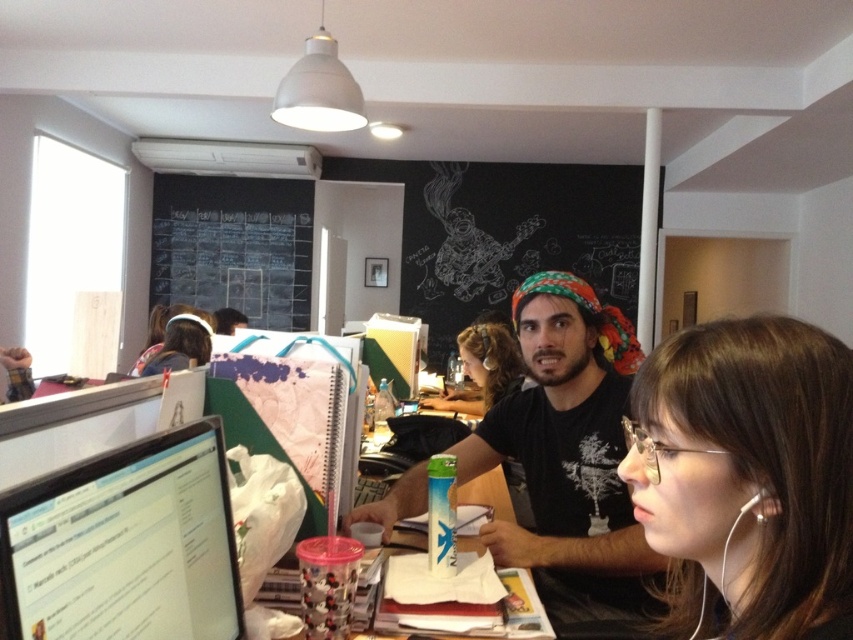
Question: Is matte black headphones at center positioned at the back of matte black hair at upper left?

Choices:
 (A) no
 (B) yes

Answer: (A)

Question: Which of these objects is positioned closest to the black t-shirt at center?

Choices:
 (A) brown hair at center
 (B) white earphone at lower right
 (C) matte black monitor at left
 (D) matte black headphones at center

Answer: (A)

Question: Based on their relative distances, which object is nearer to the matte black headphones at center?

Choices:
 (A) white earphone at lower right
 (B) black chalkboard at upper center

Answer: (B)

Question: Which of the following is the farthest from the observer?

Choices:
 (A) matte black hair at upper left
 (B) matte black headphones at center
 (C) white earphone at lower right
 (D) matte black monitor at left

Answer: (A)

Question: Is matte black monitor at left below white earphone at lower right?

Choices:
 (A) yes
 (B) no

Answer: (A)

Question: Does black t-shirt at center come behind black chalkboard at upper center?

Choices:
 (A) no
 (B) yes

Answer: (A)